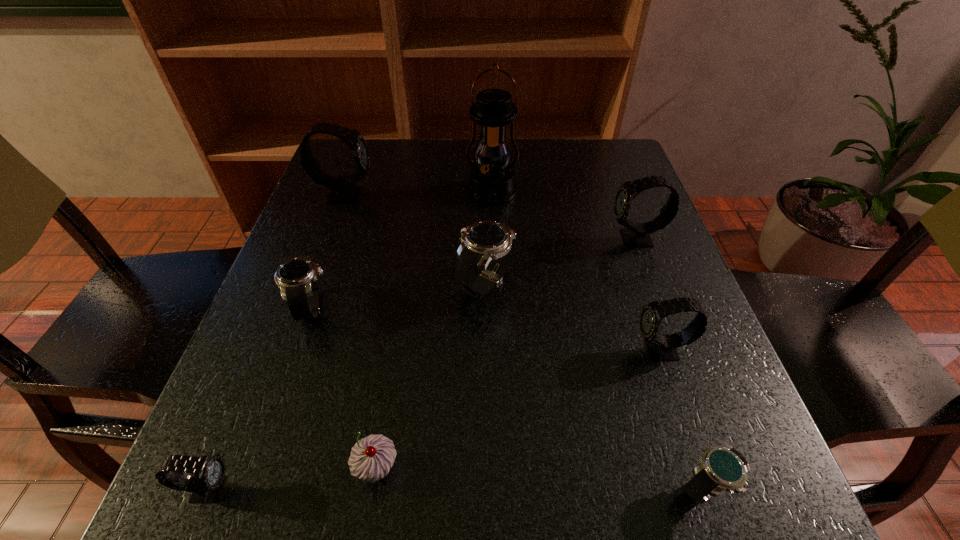
Identify the location of free space at the near left corner of the desktop. pyautogui.click(x=179, y=520).

Where is `free space at the near right corner`? This screenshot has width=960, height=540. free space at the near right corner is located at coordinates (688, 477).

Identify the location of free spot between the gray cupcake and the rightmost silver watch. Image resolution: width=960 pixels, height=540 pixels. (540, 477).

Where is `free space between the fourth object from left to right and the third farthest object`? The height and width of the screenshot is (540, 960). free space between the fourth object from left to right and the third farthest object is located at coordinates (506, 353).

This screenshot has width=960, height=540. In order to click on free spot between the second silver watch from left to right and the second farthest gray watch in this screenshot , I will do `click(562, 261)`.

At what (x,y) coordinates should I click in order to perform the action: click on vacant point located between the leftmost silver watch and the biggest silver watch. Please return your answer as a coordinate pair (x, y). Looking at the image, I should click on (399, 295).

Locate an element on the screen. This screenshot has width=960, height=540. empty space that is in between the seventh shortest object and the cupcake is located at coordinates tap(506, 353).

Identify the location of empty location between the fourth object from left to right and the smallest gray watch. This screenshot has height=540, width=960. (293, 478).

Image resolution: width=960 pixels, height=540 pixels. What are the coordinates of `free point between the shortest watch and the nearest gray watch` in the screenshot? It's located at (457, 488).

You are a GUI agent. You are given a task and a screenshot of the screen. Output one action in this format:
    pyautogui.click(x=<x>, y=<y>)
    Task: Click on the free area in between the smallest gray watch and the gray cupcake
    The image size is (960, 540).
    Given the screenshot: What is the action you would take?
    pyautogui.click(x=293, y=478)